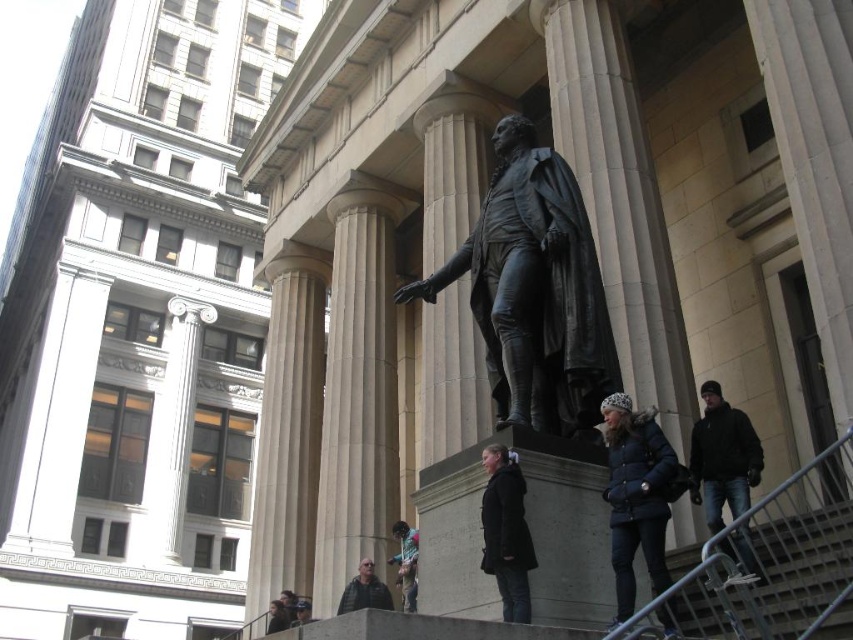
Can you confirm if smooth stone column at center is taller than black wool coat at center?

Yes.

Does smooth stone column at center have a lesser width compared to black wool coat at center?

Incorrect, smooth stone column at center's width is not less than black wool coat at center's.

Describe the element at coordinates (618, 200) in the screenshot. The image size is (853, 640). I see `smooth stone column at center` at that location.

Where is `smooth stone column at center`? This screenshot has width=853, height=640. smooth stone column at center is located at coordinates (618, 200).

Is point (741, 456) positioned after point (363, 604)?

No, it is in front of (363, 604).

Which is behind, point (699, 492) or point (383, 584)?

The point (383, 584) is more distant.

Who is more forward, (718, 516) or (374, 602)?

Positioned in front is point (718, 516).

This screenshot has width=853, height=640. I want to click on black leather jacket at lower right, so click(722, 458).

Can you confirm if beige stone column at center is wider than dark gray jacket at lower center?

Indeed, beige stone column at center has a greater width compared to dark gray jacket at lower center.

Is beige stone column at center closer to camera compared to dark gray jacket at lower center?

No, beige stone column at center is further to the viewer.

Which is in front, point (350, 268) or point (379, 600)?

Point (379, 600) is in front.

Identify the location of beige stone column at center. The image size is (853, 640). (358, 388).